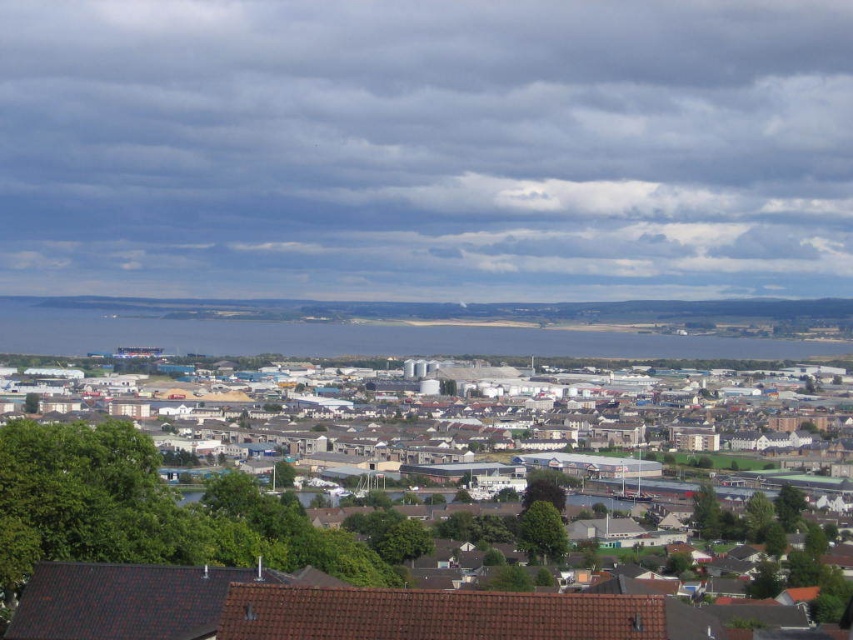
Question: Which point is farther to the camera?

Choices:
 (A) (399, 452)
 (B) (700, 342)

Answer: (B)

Question: Which of the following is the closest to the observer?

Choices:
 (A) (398, 323)
 (B) (155, 364)

Answer: (A)

Question: In this image, where is industrial buildings at center located relative to blue water at center?

Choices:
 (A) below
 (B) above

Answer: (A)

Question: Is industrial buildings at center further to the viewer compared to blue water at center?

Choices:
 (A) yes
 (B) no

Answer: (B)

Question: Which point is farther to the camera?

Choices:
 (A) (842, 369)
 (B) (222, 324)

Answer: (A)

Question: Does industrial buildings at center appear on the left side of blue water at center?

Choices:
 (A) no
 (B) yes

Answer: (A)